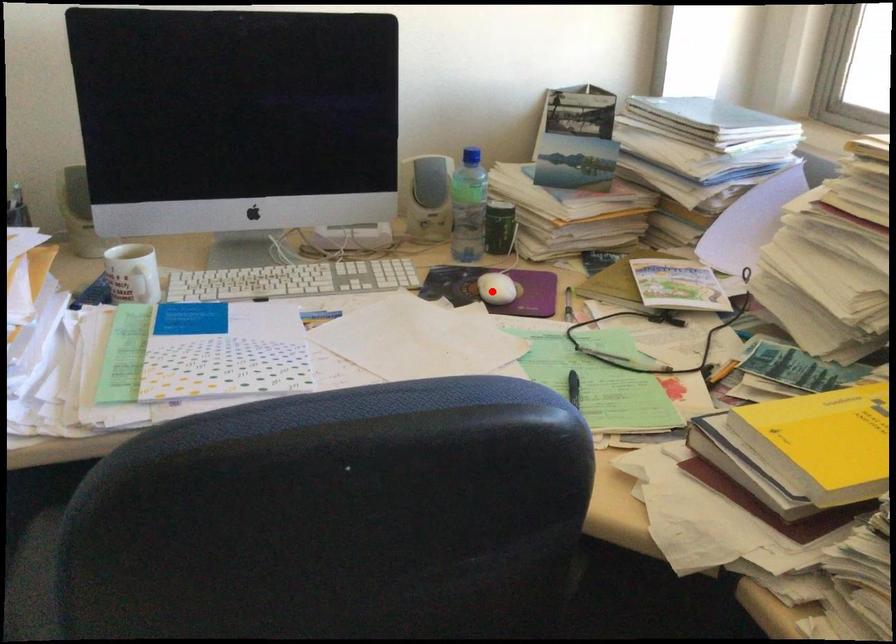
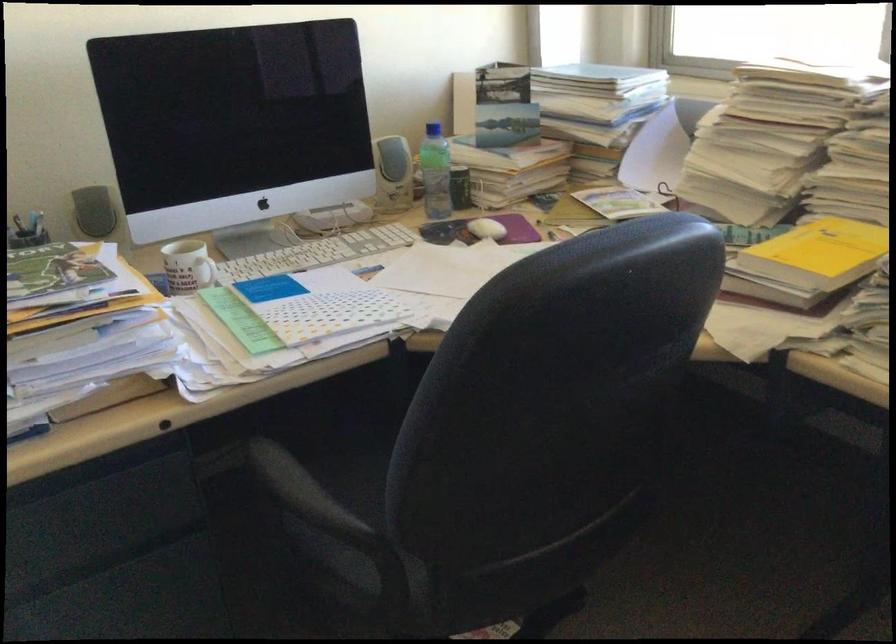
Where in the second image is the point corresponding to the highlighted location from the first image?

(487, 229)